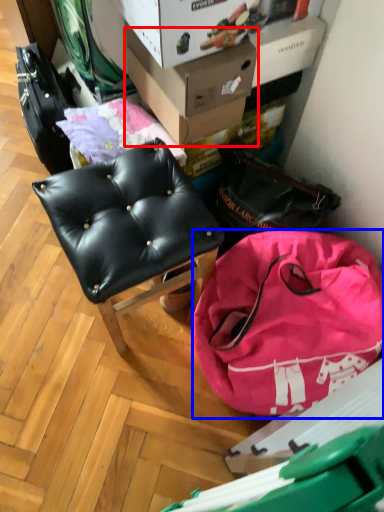
Question: Among these objects, which one is nearest to the camera, cardboard box (highlighted by a red box) or handbag (highlighted by a blue box)?

Choices:
 (A) cardboard box
 (B) handbag

Answer: (B)